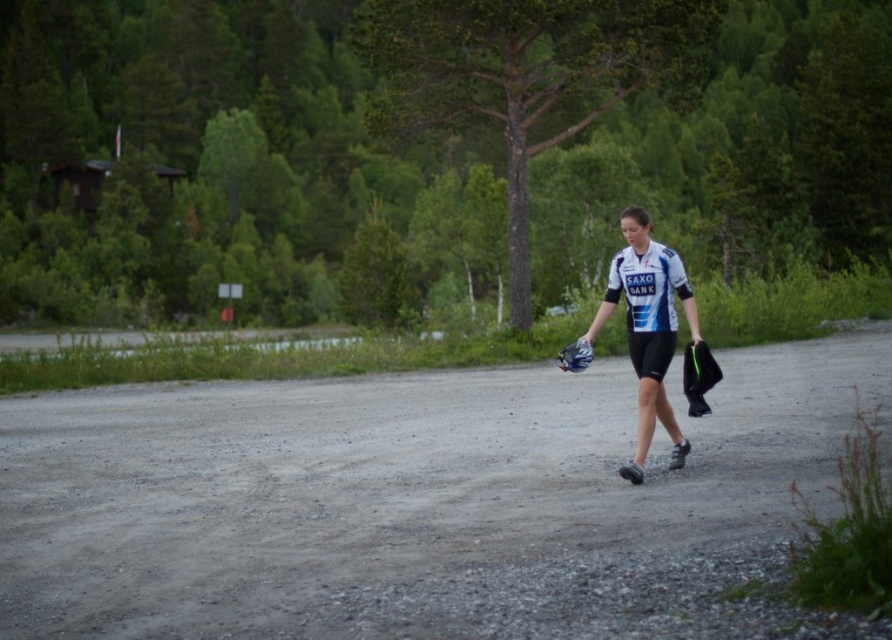
You are a drone operator trying to capture a photo of the cyclist. You need to focus on two specific points in the image labeled as point 1 at coordinates point (220, 620) and point 2 at coordinates point (582, 348). Which point should you focus on first to ensure the cyclist remains in frame as they move towards the shed on the left?

Point 1 at coordinates point (220, 620) should be focused on first because it is closer to the viewer than point 2 at coordinates point (582, 348). Since the cyclist is moving towards the shed on the left, focusing on the closer point ensures the subject stays centered as they approach the foreground.

You are a hiker who needs to reach the cabin on the left. You see a gray gravel road at center and a blue fabric baseball glove at center. Which object is closer to your current position if you are standing on the path leading towards the cabin?

The gray gravel road at center is closer to your current position because it is to the left of the blue fabric baseball glove at center, and since you are moving towards the cabin on the left, the road would be in front of the glove along your path.

You are a photographer trying to capture the white jersey at center and the blue fabric baseball glove at center in the same frame. Which object should you adjust your camera to focus on first if you want to include both in your shot?

The blue fabric baseball glove at center should be focused on first since it is positioned to the left of the white jersey at center, allowing the photographer to frame both objects by adjusting from left to right.